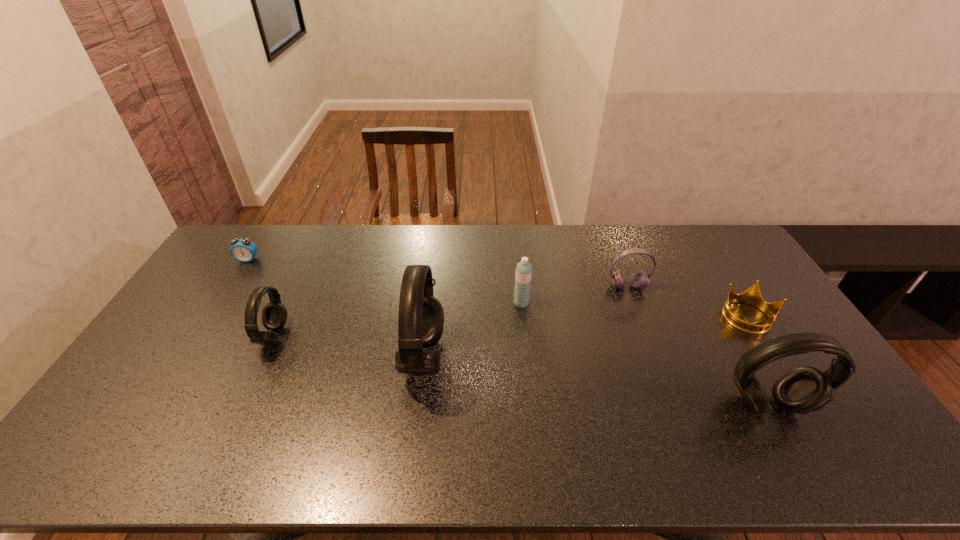
At what (x,y) coordinates should I click in order to perform the action: click on the leftmost headset. Please return your answer as a coordinate pair (x, y). This screenshot has height=540, width=960. Looking at the image, I should click on (274, 314).

I want to click on the fifth object from right to left, so click(x=421, y=317).

This screenshot has height=540, width=960. I want to click on the second tallest headset, so click(803, 390).

Locate an element on the screen. Image resolution: width=960 pixels, height=540 pixels. the sixth shortest object is located at coordinates (803, 390).

At what (x,y) coordinates should I click in order to perform the action: click on alarm clock. Please return your answer as a coordinate pair (x, y). The height and width of the screenshot is (540, 960). Looking at the image, I should click on (243, 250).

Locate an element on the screen. the farthest object is located at coordinates point(243,250).

The width and height of the screenshot is (960, 540). I want to click on the farthest headset, so click(x=640, y=279).

Identify the location of the second farthest object. (640, 279).

The image size is (960, 540). I want to click on the fourth object from left to right, so click(523, 273).

Locate an element on the screen. crown is located at coordinates (752, 296).